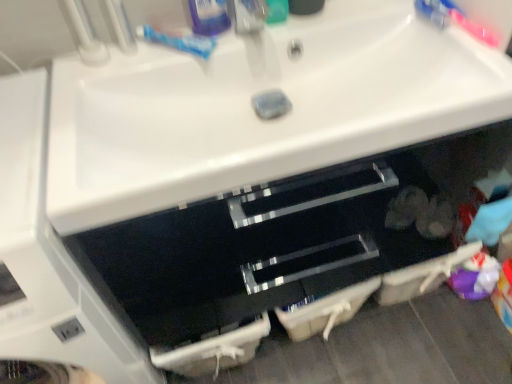
Locate an element on the screen. The image size is (512, 384). free space in front of pink plastic toothbrush at upper right is located at coordinates (466, 75).